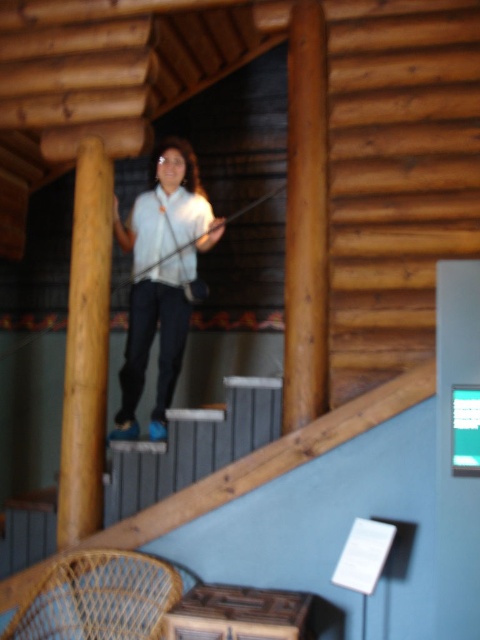
Question: Is matte white shirt at center below brown wood at left?

Choices:
 (A) yes
 (B) no

Answer: (B)

Question: Which of these objects is positioned closest to the brown wood at left?

Choices:
 (A) matte white shirt at center
 (B) white matte shirt at upper center

Answer: (A)

Question: Which of the following is the farthest from the observer?

Choices:
 (A) (137, 243)
 (B) (187, 266)
 (C) (81, 518)

Answer: (B)

Question: Which is farther from the matte white shirt at center?

Choices:
 (A) brown wood at left
 (B) white matte shirt at upper center

Answer: (A)

Question: Can you confirm if matte white shirt at center is positioned to the right of brown wood at left?

Choices:
 (A) no
 (B) yes

Answer: (B)

Question: Does matte white shirt at center lie behind brown wood at left?

Choices:
 (A) yes
 (B) no

Answer: (A)